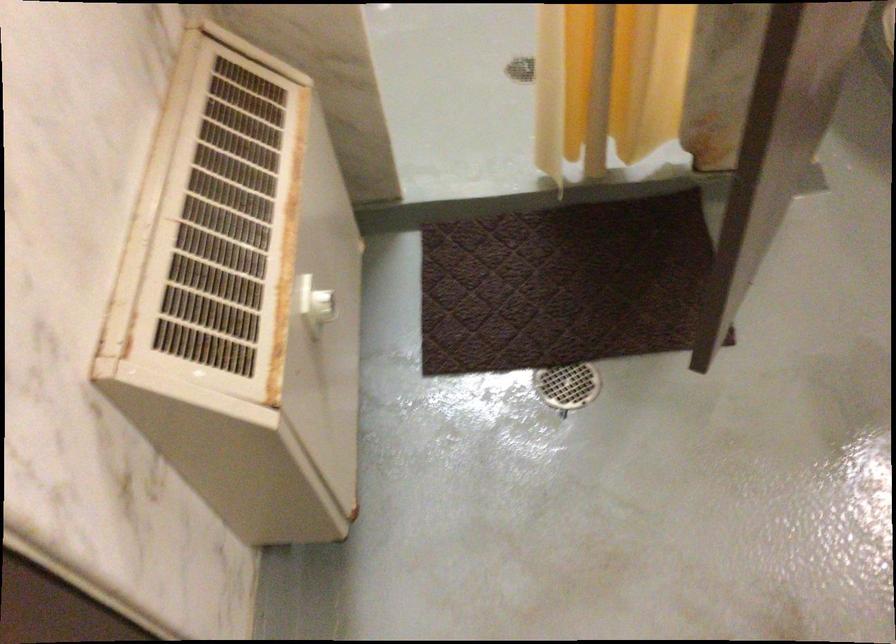
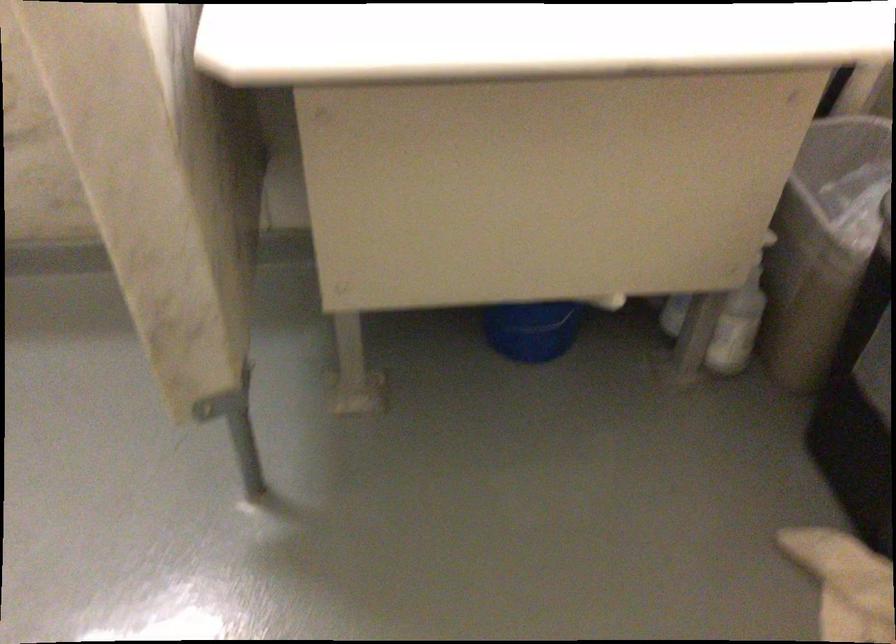
The first image is from the beginning of the video and the second image is from the end. How did the camera likely rotate when shooting the video?

The rotation direction of the camera is right-down.